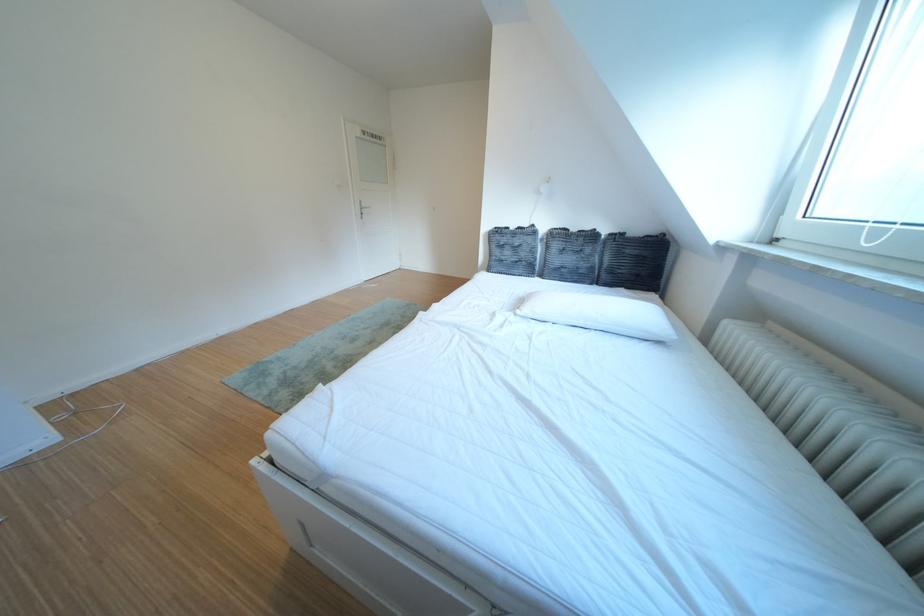
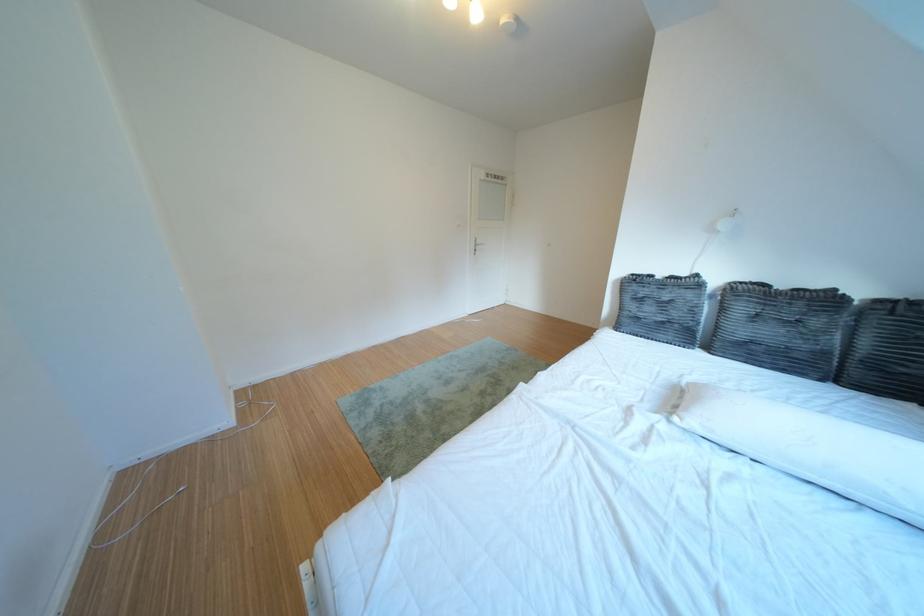
Find the pixel in the second image that matches (540,314) in the first image.

(707, 424)